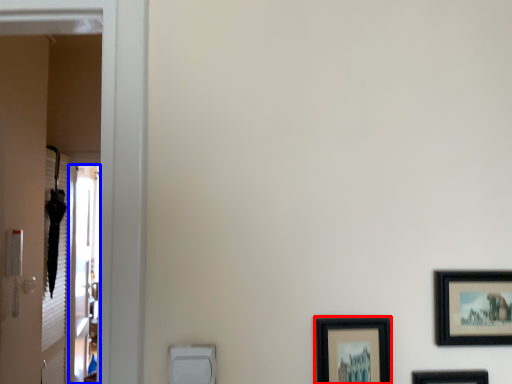
Question: Among these objects, which one is nearest to the camera, picture frame (highlighted by a red box) or screen door (highlighted by a blue box)?

Choices:
 (A) picture frame
 (B) screen door

Answer: (A)